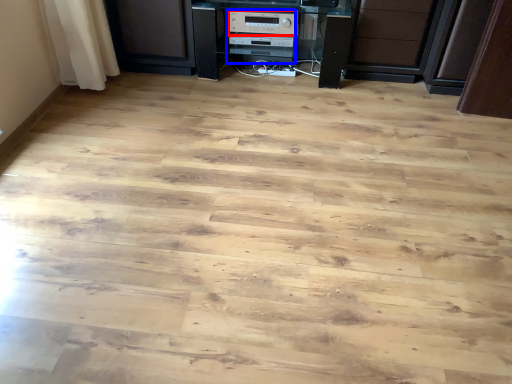
Question: Which point is closer to the camera, appliance (highlighted by a red box) or appliance (highlighted by a blue box)?

Choices:
 (A) appliance
 (B) appliance

Answer: (A)